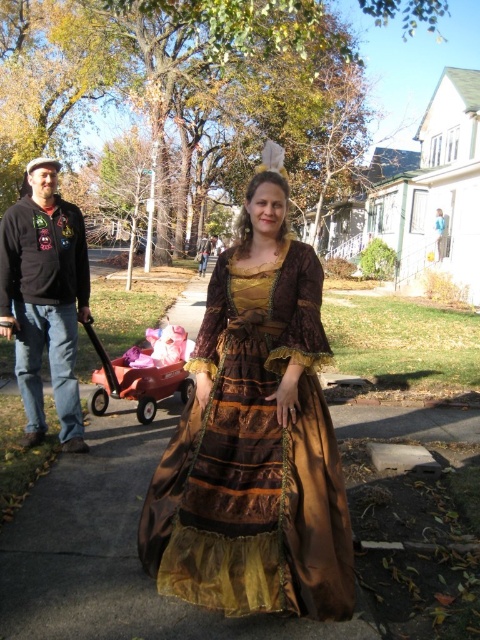
You are a delivery person who needs to carry a package that is 10 cm thick. You see the matte black jacket at left and the orange plastic wagon at lower left. Which object can fit the package based on their thickness?

The orange plastic wagon at lower left can fit the package since it is thicker than the matte black jacket at left, which is only 10 cm thick.

You are a photographer trying to capture a photo of both the shiny brown fabric dress at center and the orange plastic wagon at lower left. Since you want to ensure both are in focus, you need to know which object is taller. Can you determine which one is taller?

The shiny brown fabric dress at center is taller than the orange plastic wagon at lower left according to the description.